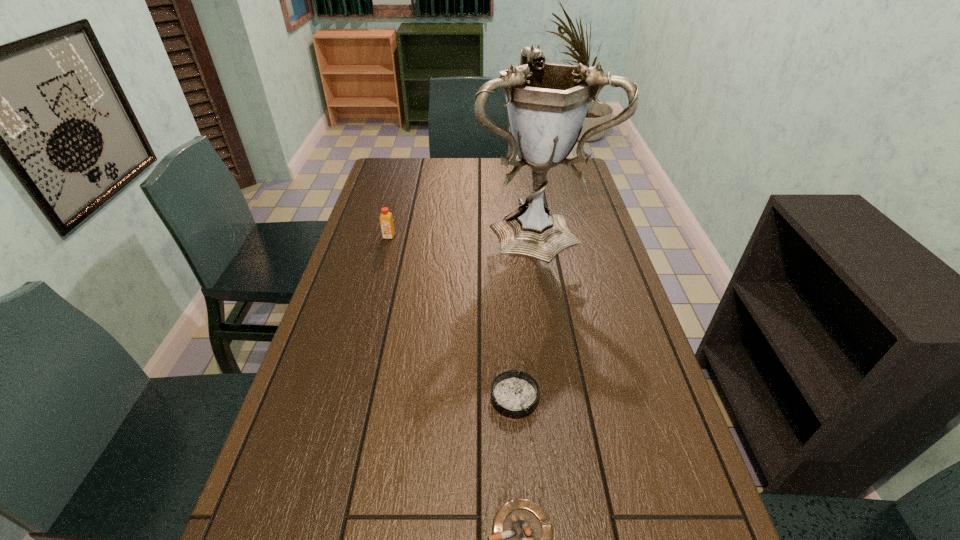
This screenshot has height=540, width=960. I want to click on trophy cup, so click(x=547, y=103).

Where is `orange juice`? The width and height of the screenshot is (960, 540). orange juice is located at coordinates (386, 221).

Where is `the leftmost object`? The height and width of the screenshot is (540, 960). the leftmost object is located at coordinates (386, 221).

Locate an element on the screen. the third farthest object is located at coordinates (514, 394).

At what (x,y) coordinates should I click in order to perform the action: click on vacant position located 0.220m on the front of the tallest object. Please return your answer as a coordinate pair (x, y). Looking at the image, I should click on (550, 313).

Locate an element on the screen. vacant space located on the front and back of the orange juice is located at coordinates (380, 271).

At what (x,y) coordinates should I click in order to perform the action: click on vacant space located on the front of the farther ashtray. Please return your answer as a coordinate pair (x, y). Looking at the image, I should click on (522, 515).

Find the location of `object that is at the left edge`. object that is at the left edge is located at coordinates (386, 221).

What are the coordinates of `object that is at the right edge` in the screenshot? It's located at (547, 103).

The height and width of the screenshot is (540, 960). In the image, there is a desktop. In order to click on vacant space at the far edge in this screenshot , I will do `click(461, 164)`.